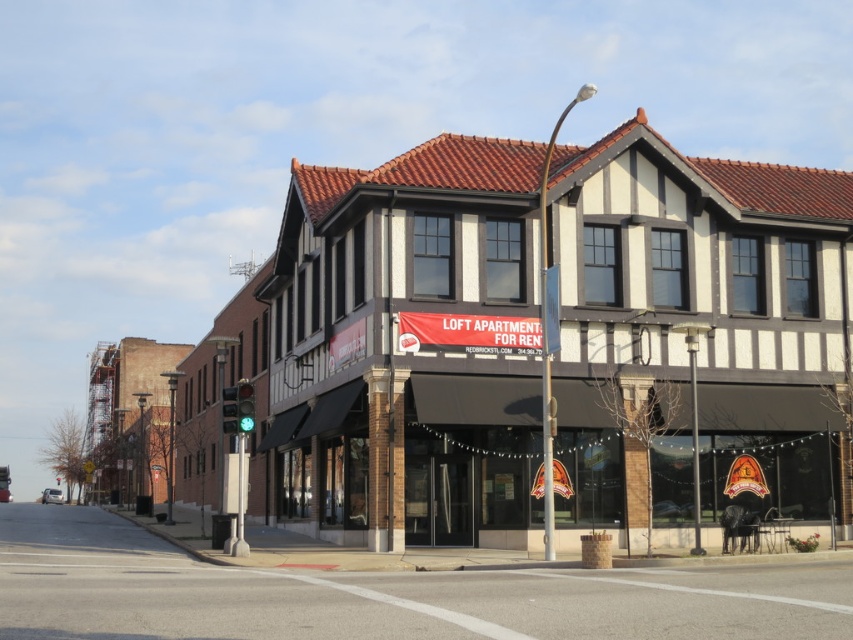
Question: Which object appears farthest from the camera in this image?

Choices:
 (A) white brick building at center
 (B) smooth concrete sidewalk at lower center

Answer: (A)

Question: Does white brick building at center appear over smooth concrete sidewalk at lower center?

Choices:
 (A) yes
 (B) no

Answer: (A)

Question: Does white brick building at center appear on the right side of smooth concrete sidewalk at lower center?

Choices:
 (A) no
 (B) yes

Answer: (B)

Question: Is white brick building at center above smooth concrete sidewalk at lower center?

Choices:
 (A) yes
 (B) no

Answer: (A)

Question: Which of the following is the closest to the observer?

Choices:
 (A) (349, 602)
 (B) (674, 316)

Answer: (A)